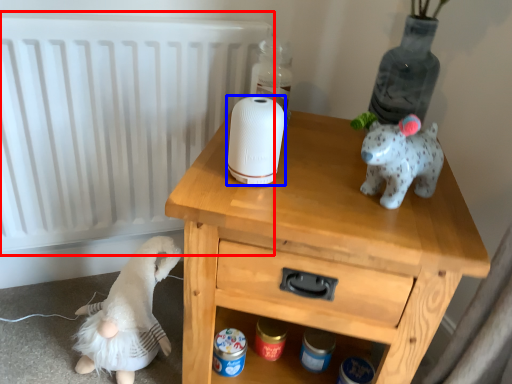
Question: Which of the following is the closest to the observer, radiator (highlighted by a red box) or toilet paper (highlighted by a blue box)?

Choices:
 (A) radiator
 (B) toilet paper

Answer: (B)